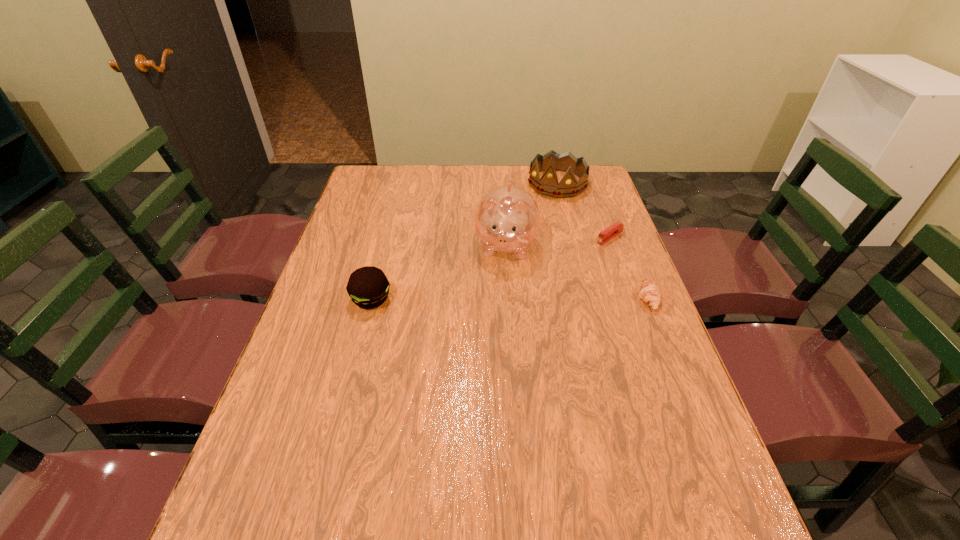
Find the location of a particular element. free space on the desktop that is between the leftmost object and the pastry and is positioned on the front-facing side of the stapler is located at coordinates (516, 299).

Find the location of `vacant space on the desktop that is between the leftmost object and the pastry and is positioned at the front of the tiara with jewels`. vacant space on the desktop that is between the leftmost object and the pastry and is positioned at the front of the tiara with jewels is located at coordinates [x=472, y=299].

Locate an element on the screen. This screenshot has width=960, height=540. free space on the desktop that is between the third shortest object and the pastry and is positioned on the front facing side of the piggy bank is located at coordinates (496, 299).